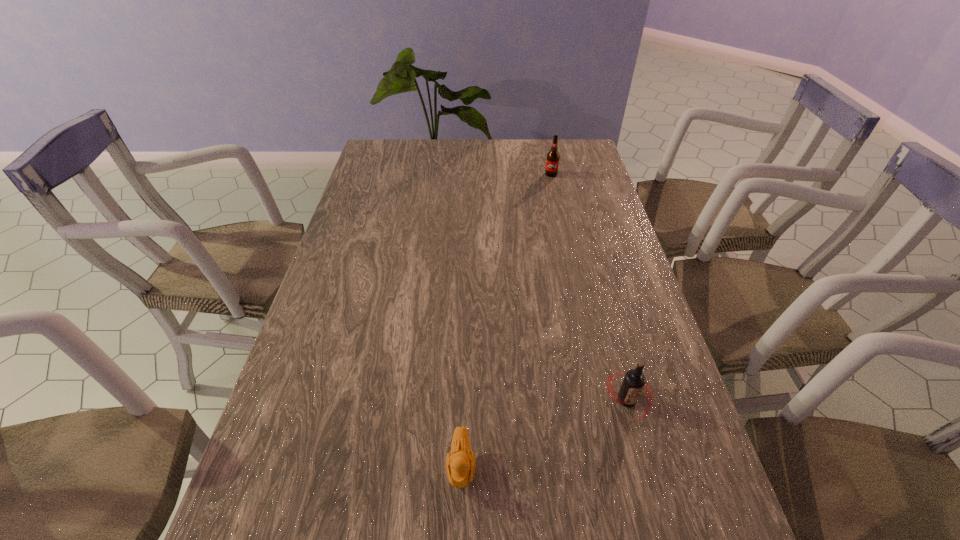
The height and width of the screenshot is (540, 960). In order to click on vacant space at the far left corner of the desktop in this screenshot , I will do `click(380, 139)`.

Identify the location of vacant area between the farther root beer and the leftmost object. (506, 320).

The width and height of the screenshot is (960, 540). I want to click on unoccupied position between the second nearest object and the nearest object, so click(544, 433).

Where is `vacant region between the nearest object and the farther root beer`? The height and width of the screenshot is (540, 960). vacant region between the nearest object and the farther root beer is located at coordinates (506, 320).

You are a GUI agent. You are given a task and a screenshot of the screen. Output one action in this format:
    pyautogui.click(x=<x>, y=<y>)
    Task: Click on the vacant point located between the farthest object and the second nearest object
    The height and width of the screenshot is (540, 960).
    Given the screenshot: What is the action you would take?
    pyautogui.click(x=589, y=287)

Locate an element on the screen. This screenshot has height=540, width=960. vacant region between the farther root beer and the shortest object is located at coordinates (506, 320).

You are a GUI agent. You are given a task and a screenshot of the screen. Output one action in this format:
    pyautogui.click(x=<x>, y=<y>)
    Task: Click on the vacant area between the duckling and the farthest object
    Image resolution: width=960 pixels, height=540 pixels.
    Given the screenshot: What is the action you would take?
    pyautogui.click(x=506, y=320)

The image size is (960, 540). Find the location of `vacant space that's between the farther root beer and the nearer root beer`. vacant space that's between the farther root beer and the nearer root beer is located at coordinates [589, 287].

You are a GUI agent. You are given a task and a screenshot of the screen. Output one action in this format:
    pyautogui.click(x=<x>, y=<y>)
    Task: Click on the free space between the farthest object and the nearer root beer
    
    Given the screenshot: What is the action you would take?
    pyautogui.click(x=589, y=287)

I want to click on vacant space that is in between the farther root beer and the second nearest object, so (589, 287).